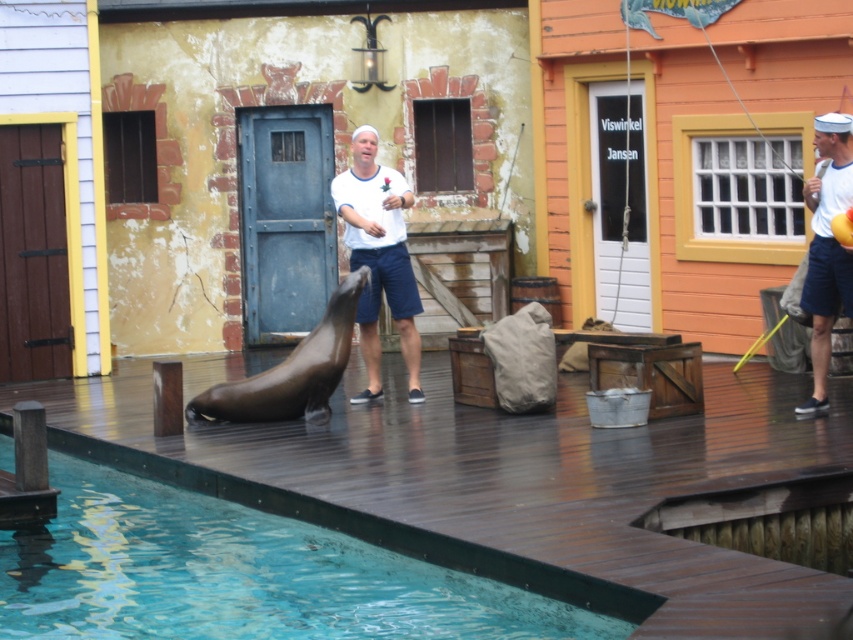
Which is in front, point (372, 161) or point (830, 234)?

Point (830, 234)

Can you confirm if white cotton shirt at center is bigger than white cotton shirt at upper right?

Correct, white cotton shirt at center is larger in size than white cotton shirt at upper right.

Find the location of a particular element. The image size is (853, 640). white cotton shirt at center is located at coordinates (379, 257).

Image resolution: width=853 pixels, height=640 pixels. I want to click on white cotton shirt at center, so click(379, 257).

Between point (447, 589) and point (809, 296), which one is positioned behind?

The point (809, 296) is more distant.

Describe the element at coordinates (241, 573) in the screenshot. The image size is (853, 640). I see `clear blue water at lower left` at that location.

Locate an element on the screen. The width and height of the screenshot is (853, 640). clear blue water at lower left is located at coordinates (241, 573).

Does clear blue water at lower left come in front of white cotton shirt at center?

Yes, clear blue water at lower left is in front of white cotton shirt at center.

Is point (485, 596) closer to camera compared to point (366, 148)?

Yes, it is.

The width and height of the screenshot is (853, 640). What are the coordinates of `clear blue water at lower left` in the screenshot? It's located at point(241,573).